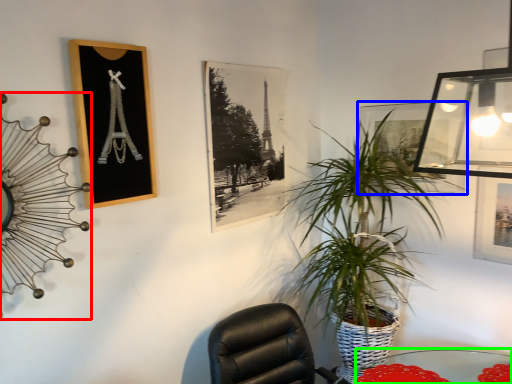
Question: Based on their relative distances, which object is nearer to clock (highlighted by a red box)? Choose from picture frame (highlighted by a blue box) and table (highlighted by a green box).

Choices:
 (A) picture frame
 (B) table

Answer: (A)